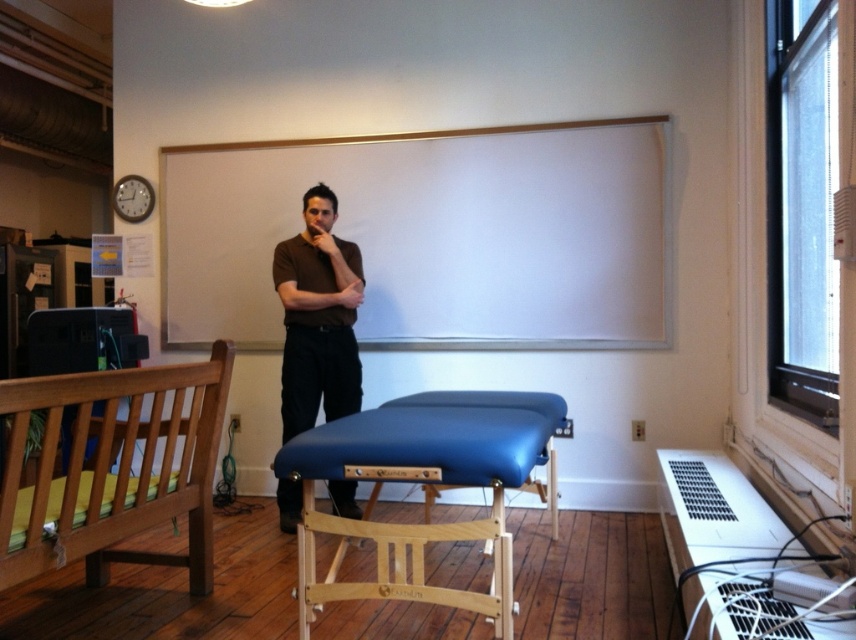
Question: Does blue leather stool at center lie in front of dark brown shirt at center?

Choices:
 (A) yes
 (B) no

Answer: (A)

Question: Which of these objects is positioned closest to the dark brown shirt at center?

Choices:
 (A) brown matte shirt at center
 (B) wooden bench at left

Answer: (A)

Question: Which of these objects is positioned farthest from the wooden bench at left?

Choices:
 (A) blue leather stool at center
 (B) matte brown arm at center
 (C) dark brown shirt at center

Answer: (B)

Question: Among these points, which one is nearest to the camera?

Choices:
 (A) (66, 394)
 (B) (337, 291)
 (C) (485, 401)
 (D) (289, 401)

Answer: (A)

Question: From the image, what is the correct spatial relationship of blue leather stool at center in relation to dark brown shirt at center?

Choices:
 (A) above
 (B) below

Answer: (B)

Question: Is blue leather stool at center positioned at the back of dark brown shirt at center?

Choices:
 (A) no
 (B) yes

Answer: (A)